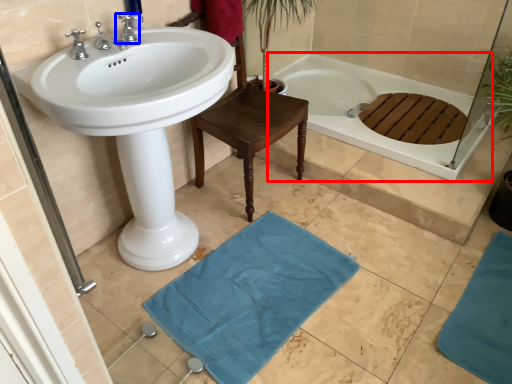
Question: Which object appears closest to the camera in this image, bathtub (highlighted by a red box) or tap (highlighted by a blue box)?

Choices:
 (A) bathtub
 (B) tap

Answer: (B)